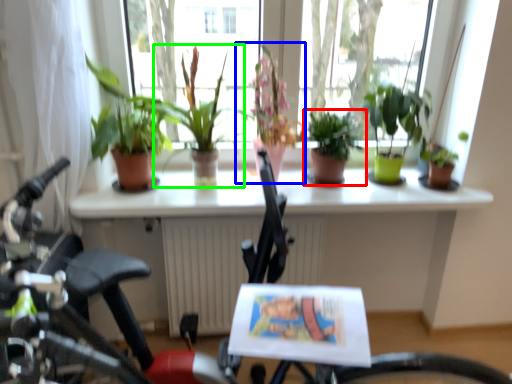
Question: Which object is positioned closest to houseplant (highlighted by a red box)? Select from houseplant (highlighted by a blue box) and houseplant (highlighted by a green box).

Choices:
 (A) houseplant
 (B) houseplant

Answer: (A)